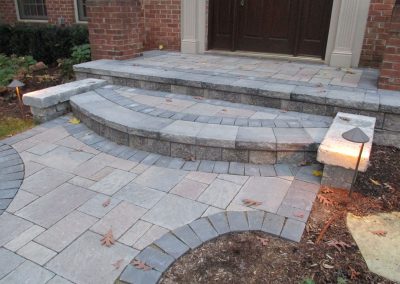
At what (x,y) coordinates should I click in order to perform the action: click on front door. Please return your answer as a coordinate pair (x, y). The image size is (400, 284). Looking at the image, I should click on (253, 21).